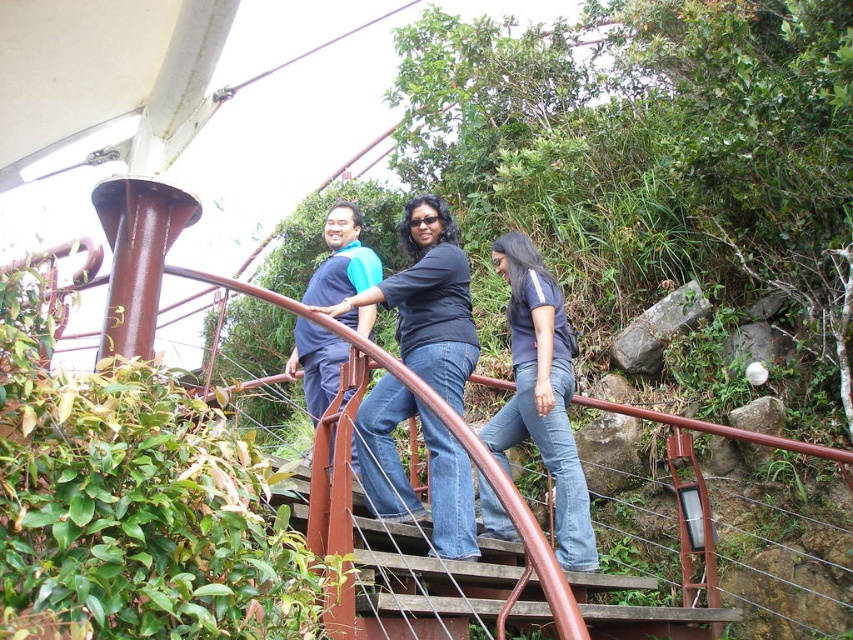
You are standing at the point labeled as point (x=502, y=460) and want to reach the top of the staircase. The staircase has a total height of 15 meters. How much farther do you need to climb?

The distance between you and the viewer is 10.26 meters, but this is a horizontal distance. The vertical distance needed to climb would depend on the staircase slope, which isn not provided in the scene description. Therefore, it is impossible to determine the remaining height to climb based on the given information.

You are a photographer standing at the bottom of the staircase. You want to take a photo of the dark blue jeans at center and the blue fabric shirt at center. Since you need to ensure both subjects are in focus, and your camera has a depth of field that can cover 10 feet. Will both subjects be in focus?

The distance between the dark blue jeans at center and the blue fabric shirt at center is 10.32 feet, which exceeds the camera depth of field of 10 feet. Therefore, both subjects may not be fully in focus.